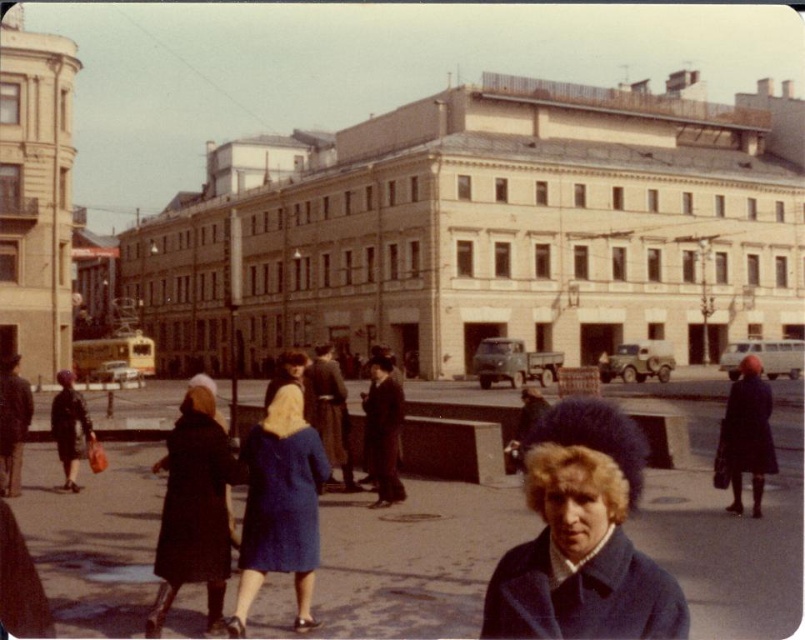
You are standing in the city square and see two points marked on the ground. The first point is at coordinates point (x=263, y=499) and the second point is at point (x=213, y=500). If you want to walk from the first point to the second point, which direction should you face?

Point (x=263, y=499) is behind point (x=213, y=500), so you should face the direction towards the second point to walk from the first point to the second point.

You are a photographer standing at the edge of the city square. You want to take a photo that includes the blue woolen coat at center. Where should you position yourself to ensure the coat is centered in your shot?

The blue woolen coat at center is already positioned at the center of the image at point coordinates (279, 506). To ensure it remains centered in your photo, you should position yourself directly facing the coat, maintaining a central alignment with the frame.

You are a photographer standing in the city square and notice two coats at the center of the scene. Which coat is shorter in height between the blue woolen coat at center and the dark blue coat at center?

The blue woolen coat at center is shorter in height compared to the dark blue coat at center.